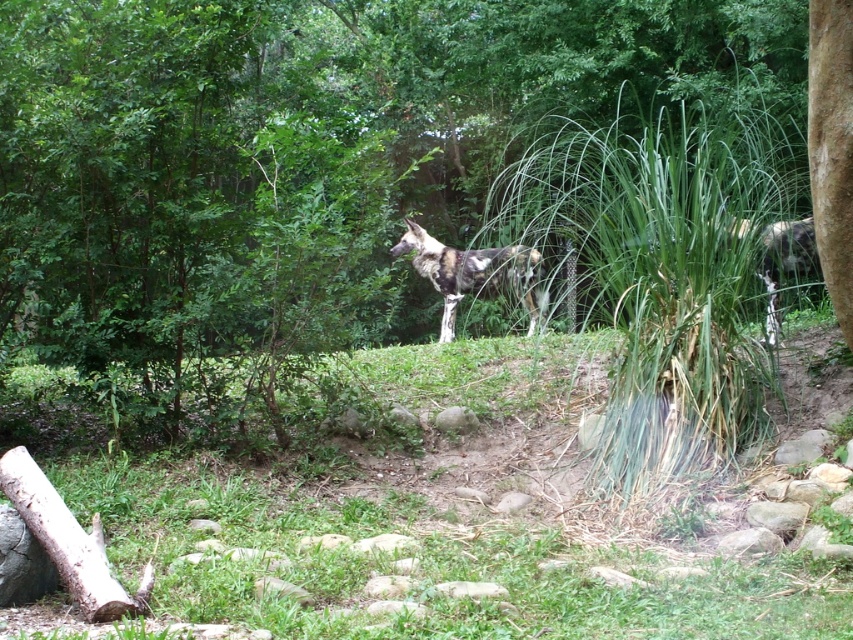
Question: Is green grass at center above spotted fur wild dog at center?

Choices:
 (A) yes
 (B) no

Answer: (B)

Question: Is green grass at center to the right of spotted fur wild dog at center from the viewer's perspective?

Choices:
 (A) yes
 (B) no

Answer: (B)

Question: Among these points, which one is farthest from the camera?

Choices:
 (A) coord(515,248)
 (B) coord(409,394)

Answer: (A)

Question: Which object appears farthest from the camera in this image?

Choices:
 (A) green grass at center
 (B) spotted fur wild dog at center

Answer: (B)

Question: Is green grass at center to the left of spotted fur wild dog at center from the viewer's perspective?

Choices:
 (A) no
 (B) yes

Answer: (B)